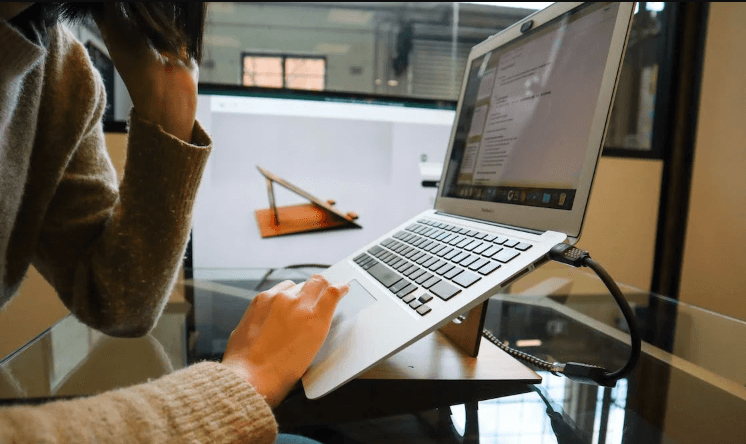
Where is `desk`? The image size is (746, 444). desk is located at coordinates (530, 429).